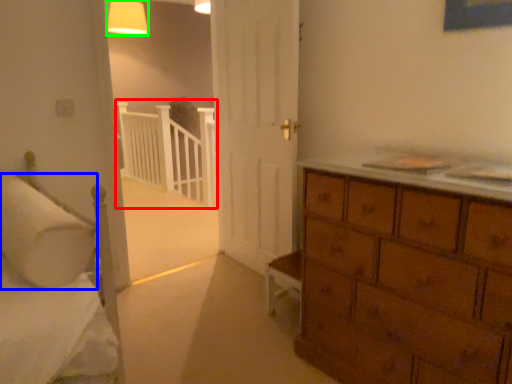
Question: Which object is positioned farthest from balustrade (highlighted by a red box)? Select from pillow (highlighted by a blue box) and lighting (highlighted by a green box).

Choices:
 (A) pillow
 (B) lighting

Answer: (A)